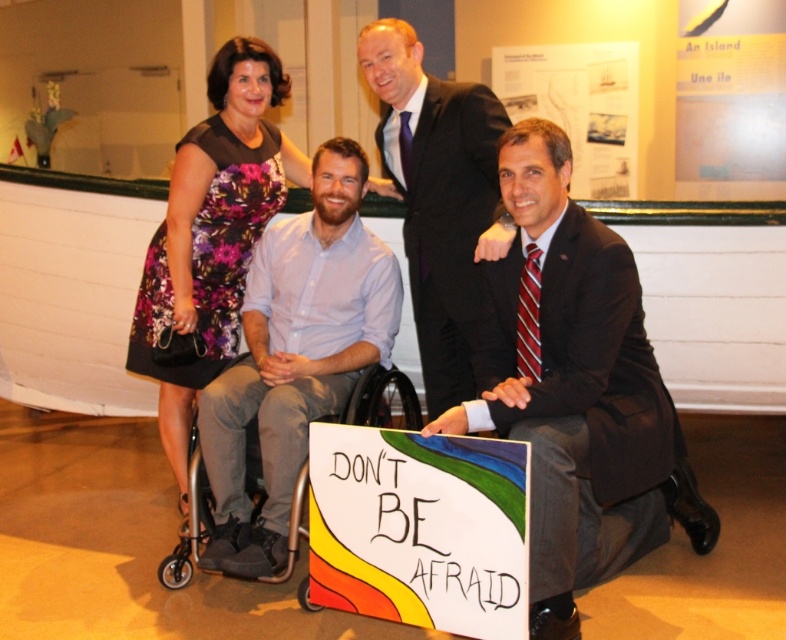
Question: Which point is closer to the camera?

Choices:
 (A) floral dress at upper left
 (B) matte black suit at upper center

Answer: (B)

Question: Does matte black suit at center appear under matte black suit at upper center?

Choices:
 (A) yes
 (B) no

Answer: (A)

Question: Which is farther from the matte black suit at upper center?

Choices:
 (A) floral dress at upper left
 (B) silver metallic wheelchair at center
 (C) hand-painted paper sign at lower center
 (D) matte black suit at center

Answer: (C)

Question: Is floral dress at upper left to the left of silver metallic wheelchair at center from the viewer's perspective?

Choices:
 (A) no
 (B) yes

Answer: (B)

Question: Is matte black suit at upper center above silver metallic wheelchair at center?

Choices:
 (A) yes
 (B) no

Answer: (A)

Question: Based on their relative distances, which object is nearer to the hand-painted paper sign at lower center?

Choices:
 (A) light purple shirt at center
 (B) floral dress at upper left
 (C) matte black suit at center
 (D) matte black suit at upper center

Answer: (C)